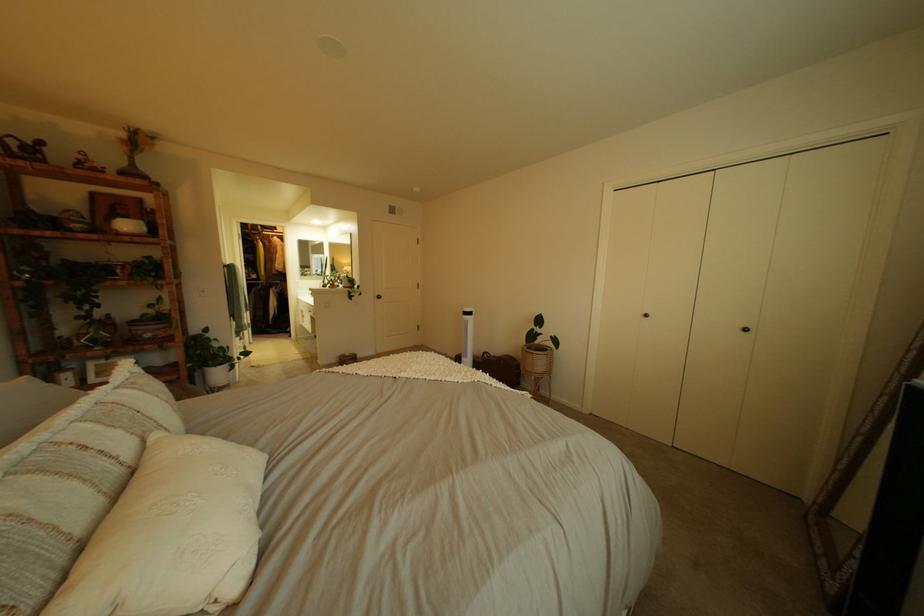
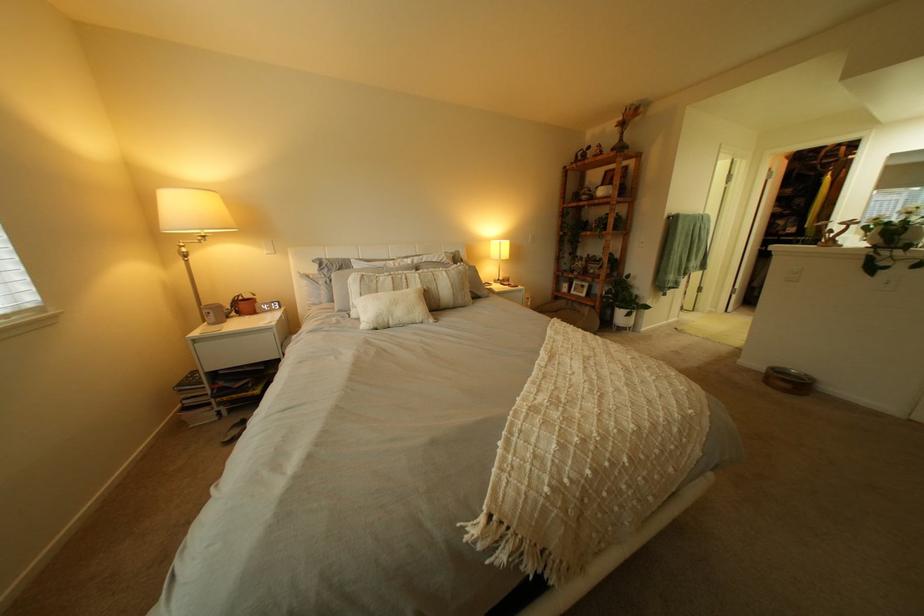
Locate, in the second image, the point that corresponds to the point at 348,362 in the first image.

(779, 369)